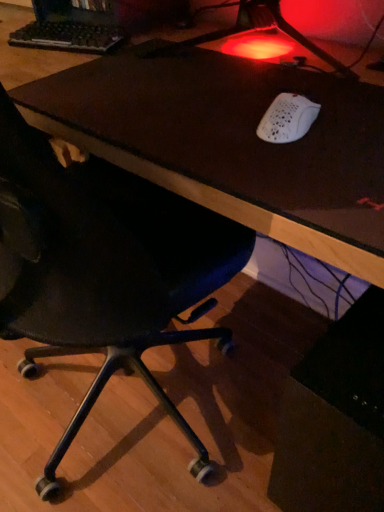
Where is `free space that is to the left of white matte mouse at upper right`? This screenshot has width=384, height=512. free space that is to the left of white matte mouse at upper right is located at coordinates (190, 128).